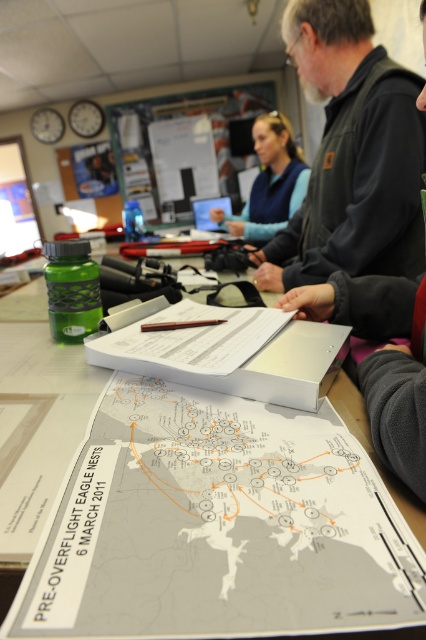
You are a conservation worker who needs to place a new document on the table. The white paper map at center and the blue fleece vest at center are already there. Which object can you move to make more space?

The blue fleece vest at center occupies more space than the white paper map at center, so moving it would create more space.

You are a researcher in the meeting room and need to locate the white paper map at center. According to the coordinates provided, where should you look on the table?

The white paper map at center is located at point (216, 525) on the table.

You are a wildlife researcher holding a measuring tool that requires you to be exactly 12 inches away from an object to get an accurate reading. You need to measure the distance between the point at (219, 548) and another point on the map. Can you get an accurate reading of this point without moving closer or farther?

The point at (219, 548) is 13.39 inches from the camera, which is farther than the required 12 inches for accurate measurement. Therefore, you cannot get an accurate reading without moving closer.